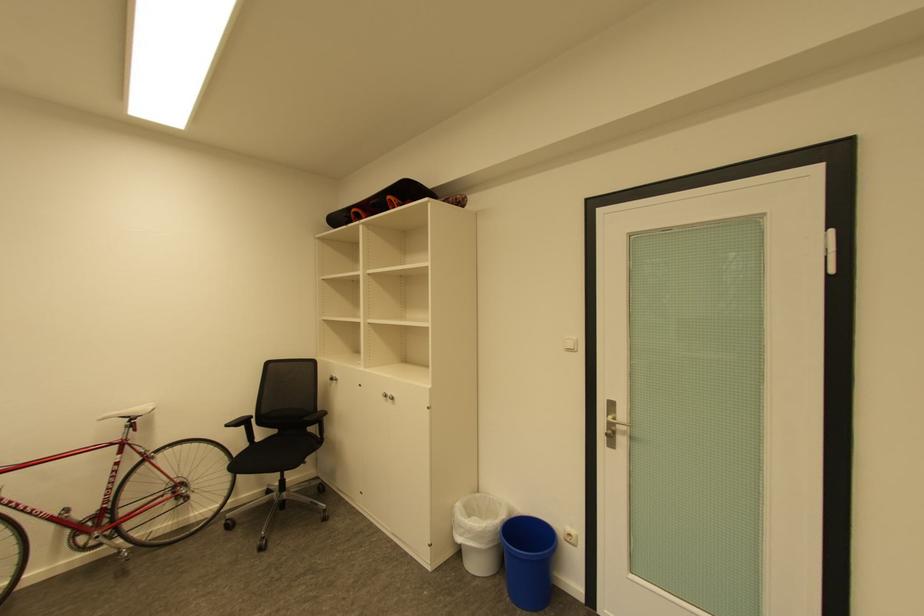
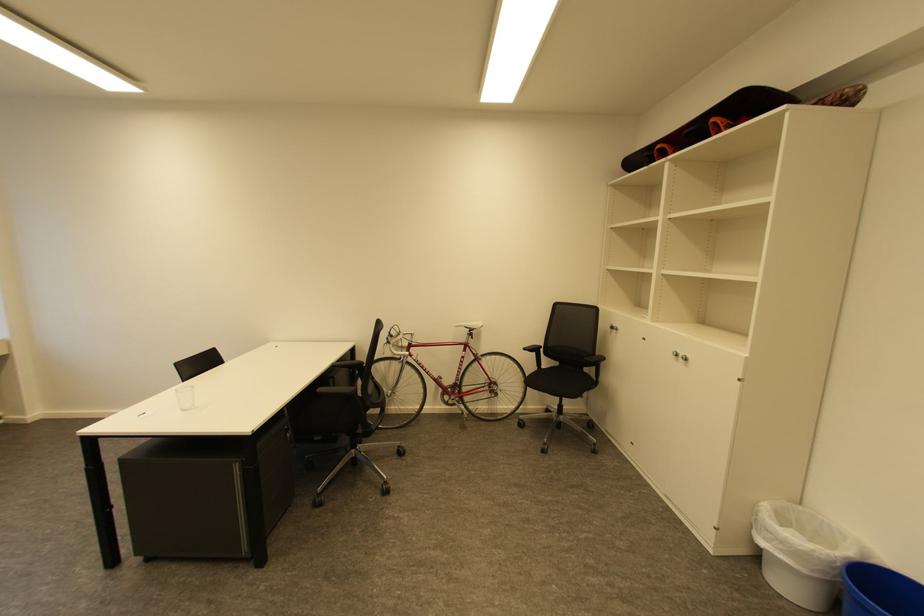
In the second image, find the point that corresponds to pixel 513 522 in the first image.

(860, 561)